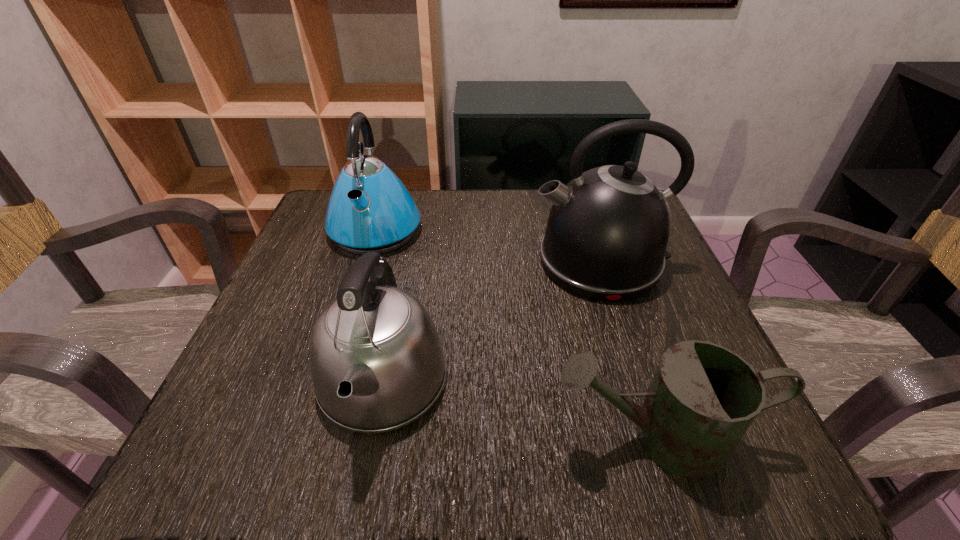
The image size is (960, 540). Find the location of `blank space that satisfies the following two spatial constraints: 1. on the spout of the rightmost kettle; 2. on the spout of the nearest kettle`. blank space that satisfies the following two spatial constraints: 1. on the spout of the rightmost kettle; 2. on the spout of the nearest kettle is located at coordinates (639, 381).

The width and height of the screenshot is (960, 540). Identify the location of free spot that satisfies the following two spatial constraints: 1. on the spout of the rightmost kettle; 2. on the spout of the nearest kettle. click(639, 381).

Locate an element on the screen. vacant space that satisfies the following two spatial constraints: 1. on the spout of the rightmost kettle; 2. on the spout of the nearest kettle is located at coordinates (639, 381).

At what (x,y) coordinates should I click in order to perform the action: click on free point that satisfies the following two spatial constraints: 1. on the spout of the rightmost kettle; 2. on the spout of the nearest kettle. Please return your answer as a coordinate pair (x, y). This screenshot has width=960, height=540. Looking at the image, I should click on (639, 381).